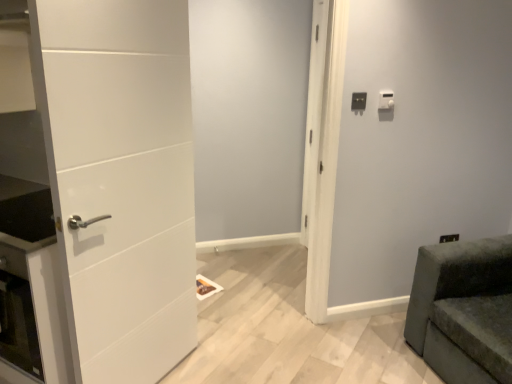
This screenshot has width=512, height=384. I want to click on white matte door at center, so click(x=249, y=114).

This screenshot has width=512, height=384. I want to click on white plastic light switch at upper right, positioned as the second light switch in left-to-right order, so click(x=386, y=100).

How much space does white plastic light switch at upper right, positioned as the second light switch in left-to-right order, occupy horizontally?

white plastic light switch at upper right, positioned as the second light switch in left-to-right order, is 1.23 inches wide.

This screenshot has height=384, width=512. What are the coordinates of `velvet green sofa at lower right` in the screenshot? It's located at (464, 310).

What is the approximate height of white plastic light switch at upper right, arranged as the 1th light switch when viewed from the left?

3.63 inches.

Identify the location of white matte door at center. 249,114.

From the image's perspective, is white plastic light switch at upper right, positioned as the second light switch in left-to-right order, above or below white plastic light switch at upper right, arranged as the 1th light switch when viewed from the left?

white plastic light switch at upper right, positioned as the second light switch in left-to-right order, is situated higher than white plastic light switch at upper right, arranged as the 1th light switch when viewed from the left, in the image.

Does white plastic light switch at upper right, positioned as the second light switch in left-to-right order, turn towards white plastic light switch at upper right, the 2th light switch viewed from the right?

No, white plastic light switch at upper right, positioned as the second light switch in left-to-right order, is not oriented towards white plastic light switch at upper right, the 2th light switch viewed from the right.

Could you measure the distance between white plastic light switch at upper right, positioned as the second light switch in left-to-right order, and white plastic light switch at upper right, arranged as the 1th light switch when viewed from the left?

white plastic light switch at upper right, positioned as the second light switch in left-to-right order, and white plastic light switch at upper right, arranged as the 1th light switch when viewed from the left, are 5.13 inches apart.

Is white plastic light switch at upper right, positioned as the second light switch in left-to-right order, wider or thinner than white plastic light switch at upper right, the 2th light switch viewed from the right?

white plastic light switch at upper right, positioned as the second light switch in left-to-right order, is wider than white plastic light switch at upper right, the 2th light switch viewed from the right.

From the picture: Between velvet green sofa at lower right and white matte door at left, which one has more height?

white matte door at left is taller.

Measure the distance between velvet green sofa at lower right and white matte door at left.

velvet green sofa at lower right and white matte door at left are 4.94 feet apart.

Considering the sizes of objects velvet green sofa at lower right and white matte door at left in the image provided, who is wider, velvet green sofa at lower right or white matte door at left?

velvet green sofa at lower right.

Are velvet green sofa at lower right and white matte door at left far apart?

Yes, velvet green sofa at lower right is far from white matte door at left.

Is white matte door at left facing away from white plastic light switch at upper right, arranged as the 1th light switch when viewed from the left?

That's not correct — white matte door at left is not looking away from white plastic light switch at upper right, arranged as the 1th light switch when viewed from the left.

How many degrees apart are the facing directions of white matte door at left and white plastic light switch at upper right, arranged as the 1th light switch when viewed from the left?

The angle between the facing direction of white matte door at left and the facing direction of white plastic light switch at upper right, arranged as the 1th light switch when viewed from the left, is 45.8 degrees.

Who is bigger, white matte door at left or white plastic light switch at upper right, the 2th light switch viewed from the right?

white matte door at left is bigger.

From the image's perspective, would you say white plastic light switch at upper right, the 2th light switch viewed from the right, is positioned over white matte door at center?

Yes, from the image's perspective, white plastic light switch at upper right, the 2th light switch viewed from the right, is over white matte door at center.

Consider the image. Can you confirm if white plastic light switch at upper right, arranged as the 1th light switch when viewed from the left, is bigger than white matte door at center?

No.

Between white plastic light switch at upper right, arranged as the 1th light switch when viewed from the left, and white matte door at center, which one has smaller width?

Thinner between the two is white plastic light switch at upper right, arranged as the 1th light switch when viewed from the left.

Which is in front, white plastic light switch at upper right, arranged as the 1th light switch when viewed from the left, or white matte door at center?

white matte door at center is more forward.

Considering the relative sizes of white matte door at left and white matte door at center in the image provided, is white matte door at left taller than white matte door at center?

In fact, white matte door at left may be shorter than white matte door at center.

Locate an element on the screen. This screenshot has height=384, width=512. door directly beneath the white matte door at center (from a real-world perspective) is located at coordinates (121, 179).

Based on the photo, from a real-world perspective, relative to white matte door at center, is white matte door at left vertically above or below?

In terms of real-world spatial position, white matte door at left is below white matte door at center.

Looking at this image, from the image's perspective, is white plastic light switch at upper right, arranged as the 1th light switch when viewed from the left, located above or below velvet green sofa at lower right?

Based on their image positions, white plastic light switch at upper right, arranged as the 1th light switch when viewed from the left, is located above velvet green sofa at lower right.

Is white plastic light switch at upper right, arranged as the 1th light switch when viewed from the left, far away from velvet green sofa at lower right?

Yes.

Relative to velvet green sofa at lower right, is white plastic light switch at upper right, the 2th light switch viewed from the right, in front or behind?

Clearly, white plastic light switch at upper right, the 2th light switch viewed from the right, is behind velvet green sofa at lower right.

Considering the sizes of objects white plastic light switch at upper right, the 2th light switch viewed from the right, and velvet green sofa at lower right in the image provided, who is shorter, white plastic light switch at upper right, the 2th light switch viewed from the right, or velvet green sofa at lower right?

With less height is white plastic light switch at upper right, the 2th light switch viewed from the right.

Considering the relative positions of white matte door at center and white matte door at left in the image provided, is white matte door at center behind white matte door at left?

Yes, white matte door at center is further from the viewer.

Considering the relative sizes of white matte door at center and white matte door at left in the image provided, is white matte door at center wider than white matte door at left?

No.

From the image's perspective, which is below, white matte door at center or white matte door at left?

white matte door at left.

Where is `light switch below the white plastic light switch at upper right, positioned as the second light switch in left-to-right order (from the image's perspective)`? Image resolution: width=512 pixels, height=384 pixels. light switch below the white plastic light switch at upper right, positioned as the second light switch in left-to-right order (from the image's perspective) is located at coordinates (358, 101).

Identify the location of door located in front of the velvet green sofa at lower right. (121, 179).

Which object lies further to the anchor point white plastic light switch at upper right, positioned as the second light switch in left-to-right order, white matte door at left or white plastic light switch at upper right, the 2th light switch viewed from the right?

white matte door at left is further to white plastic light switch at upper right, positioned as the second light switch in left-to-right order.

Which object lies further to the anchor point velvet green sofa at lower right, white plastic light switch at upper right, positioned as the second light switch in left-to-right order, or white matte door at left?

The object further to velvet green sofa at lower right is white matte door at left.

Looking at the image, which one is located further to velvet green sofa at lower right, white plastic light switch at upper right, positioned as the second light switch in left-to-right order, or white plastic light switch at upper right, the 2th light switch viewed from the right?

white plastic light switch at upper right, the 2th light switch viewed from the right.

Looking at the image, which one is located closer to velvet green sofa at lower right, white matte door at center or white plastic light switch at upper right, positioned as the second light switch in left-to-right order?

white plastic light switch at upper right, positioned as the second light switch in left-to-right order, is closer to velvet green sofa at lower right.

When comparing their distances from white plastic light switch at upper right, arranged as the 1th light switch when viewed from the left, does velvet green sofa at lower right or white plastic light switch at upper right, the 1th light switch viewed from the right, seem closer?

white plastic light switch at upper right, the 1th light switch viewed from the right, is positioned closer to the anchor white plastic light switch at upper right, arranged as the 1th light switch when viewed from the left.

From the image, which object appears to be nearer to white plastic light switch at upper right, the 2th light switch viewed from the right, white plastic light switch at upper right, positioned as the second light switch in left-to-right order, or velvet green sofa at lower right?

Based on the image, white plastic light switch at upper right, positioned as the second light switch in left-to-right order, appears to be nearer to white plastic light switch at upper right, the 2th light switch viewed from the right.

Estimate the real-world distances between objects in this image. Which object is further from white plastic light switch at upper right, the 1th light switch viewed from the right, white matte door at center or velvet green sofa at lower right?

white matte door at center lies further to white plastic light switch at upper right, the 1th light switch viewed from the right, than the other object.

Considering their positions, is white plastic light switch at upper right, the 1th light switch viewed from the right, positioned closer to white plastic light switch at upper right, the 2th light switch viewed from the right, than white matte door at left?

Based on the image, white plastic light switch at upper right, the 1th light switch viewed from the right, appears to be nearer to white plastic light switch at upper right, the 2th light switch viewed from the right.

At what (x,y) coordinates should I click in order to perform the action: click on light switch between white matte door at center and white plastic light switch at upper right, positioned as the second light switch in left-to-right order. Please return your answer as a coordinate pair (x, y). The image size is (512, 384). Looking at the image, I should click on (358, 101).

Where is `screen door between white matte door at left and white plastic light switch at upper right, positioned as the second light switch in left-to-right order, from left to right`? This screenshot has height=384, width=512. screen door between white matte door at left and white plastic light switch at upper right, positioned as the second light switch in left-to-right order, from left to right is located at coordinates pos(249,114).

In order to click on screen door between white matte door at left and velvet green sofa at lower right in the horizontal direction in this screenshot , I will do `click(249, 114)`.

In order to click on screen door situated between white matte door at left and white plastic light switch at upper right, arranged as the 1th light switch when viewed from the left, from left to right in this screenshot , I will do `click(249, 114)`.